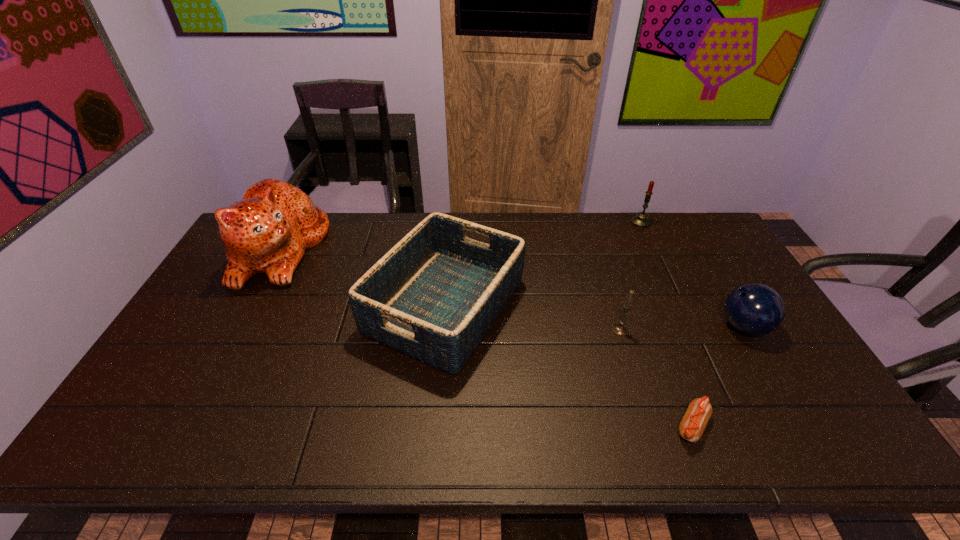
Where is `the tallest object`? The height and width of the screenshot is (540, 960). the tallest object is located at coordinates (267, 232).

The image size is (960, 540). I want to click on the leftmost object, so click(x=267, y=232).

Identify the location of the farther candle. point(641,220).

The width and height of the screenshot is (960, 540). In order to click on the second object from right to left in this screenshot , I will do coord(641,220).

Where is `the fifth object from right to left`? Image resolution: width=960 pixels, height=540 pixels. the fifth object from right to left is located at coordinates (434, 296).

Identify the location of the third object from left to right. (621, 329).

Locate an element on the screen. the left candle is located at coordinates [621, 329].

Locate an element on the screen. This screenshot has height=540, width=960. the rightmost object is located at coordinates (755, 309).

Where is `the third object from right to left`? Image resolution: width=960 pixels, height=540 pixels. the third object from right to left is located at coordinates (691, 428).

Image resolution: width=960 pixels, height=540 pixels. Identify the location of sausage. (691, 428).